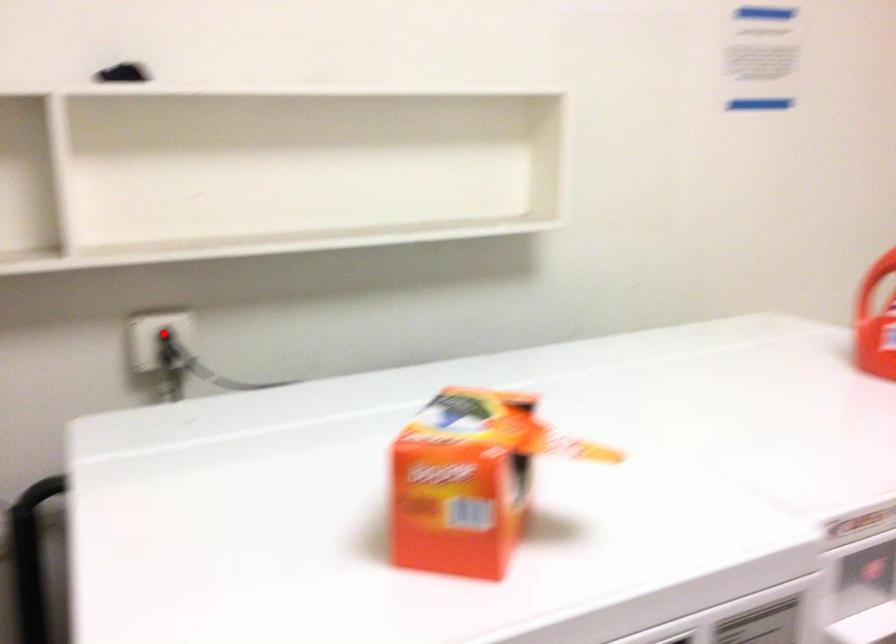
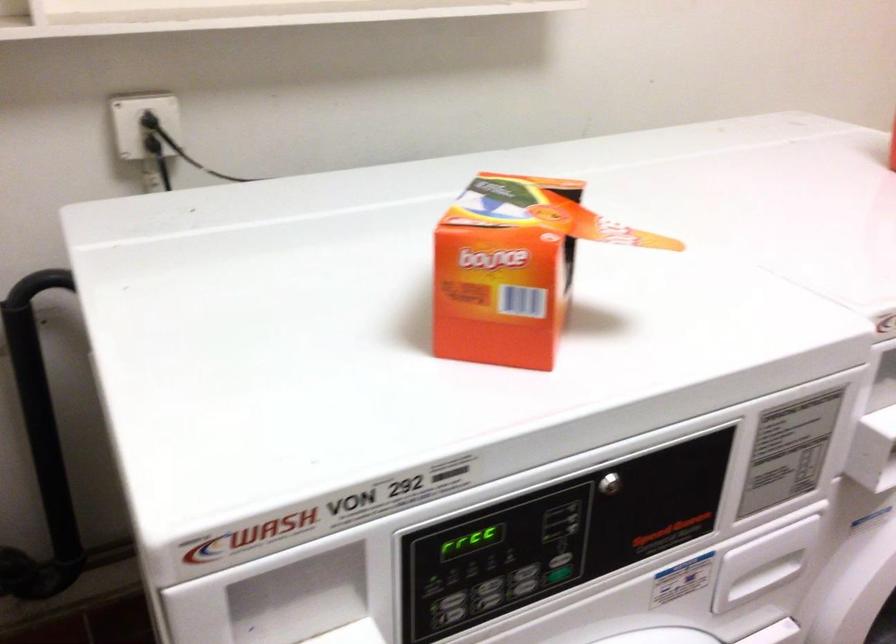
Locate, in the second image, the point that corresponds to the highlighted location in the first image.

(150, 122)